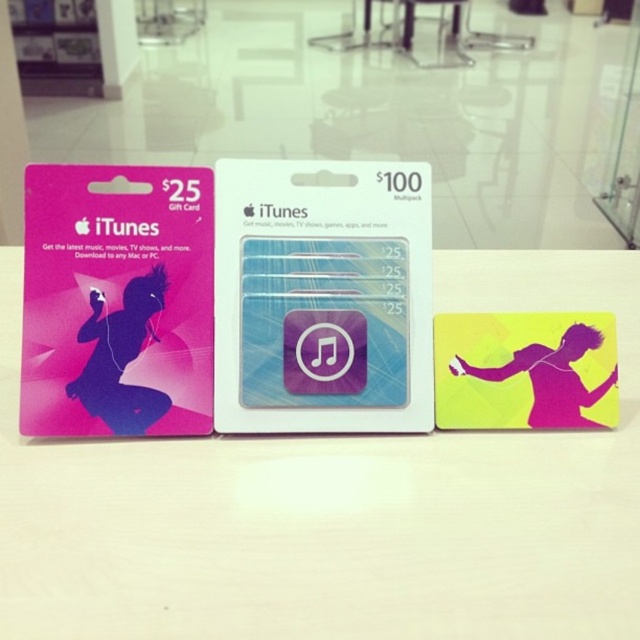
You are holding a 1.5 meter long pole. Can you touch the point at coordinates (161, 397) with the pole without moving your position?

The point at coordinates (161, 397) is 1.21 meters away from the viewer. Since the pole is 1.5 meters long, you can reach it without moving.